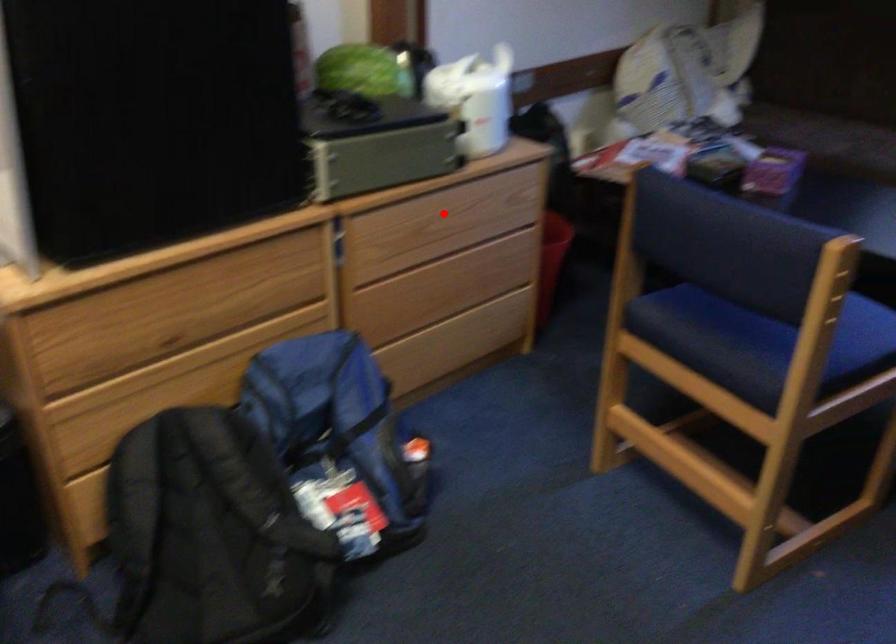
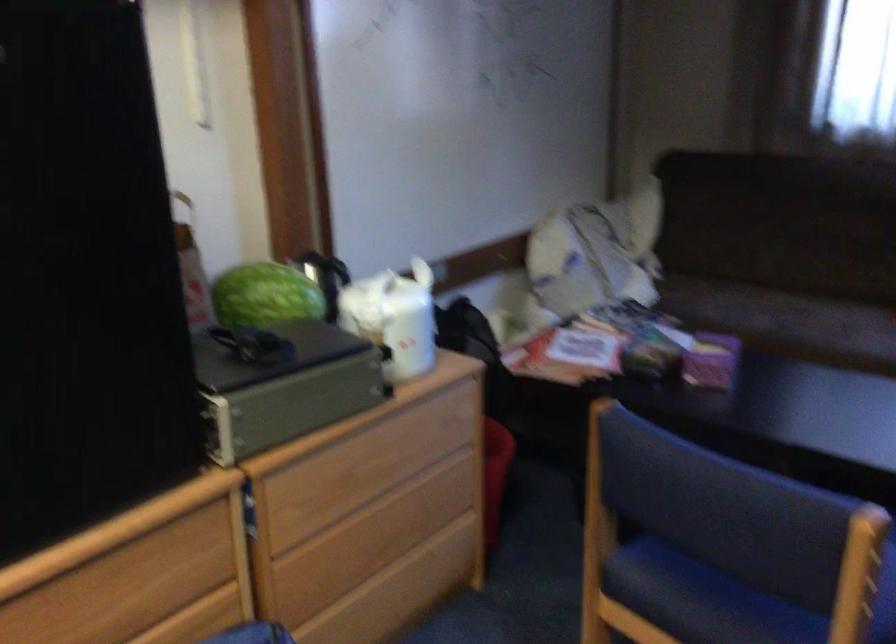
Question: I am providing you with two images of the same scene from different viewpoints. A red point is shown in image1. For the corresponding object point in image2, is it positioned nearer or farther from the camera?

Choices:
 (A) Nearer
 (B) Farther

Answer: (A)